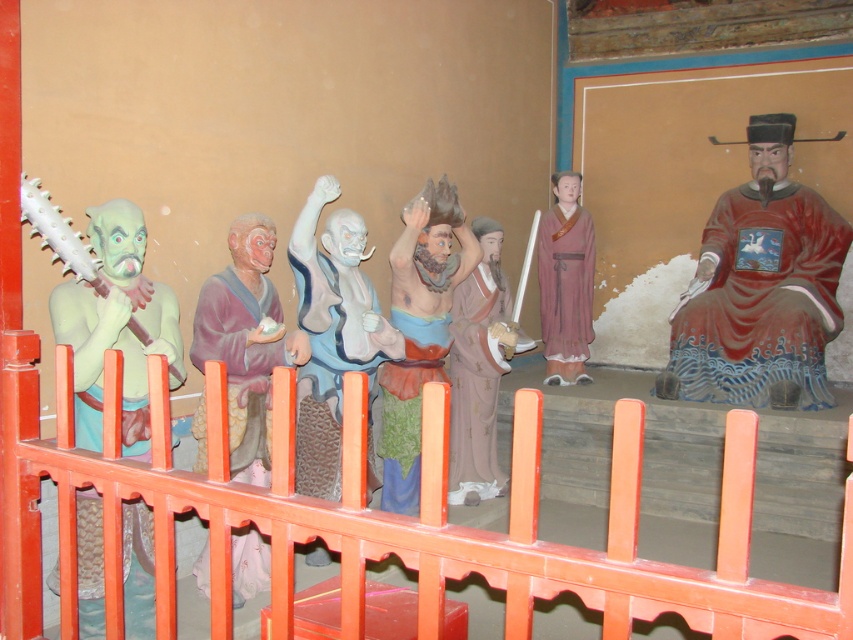
Question: Is red glossy robe at right below pink silk robe at center?

Choices:
 (A) yes
 (B) no

Answer: (B)

Question: Which is nearer to the green painted wood figure at left?

Choices:
 (A) pink silk robe at center
 (B) orange painted wood rail at center
 (C) matte brown robe at center

Answer: (B)

Question: Does matte clay figure at center come in front of white matte robe at center?

Choices:
 (A) no
 (B) yes

Answer: (A)

Question: Which object is positioned farthest from the green painted wood figure at left?

Choices:
 (A) matte clay figure at center
 (B) matte brown robe at center
 (C) matte pink robe at center

Answer: (B)

Question: Which point is farther to the camera?

Choices:
 (A) white matte robe at center
 (B) red glossy robe at right

Answer: (B)

Question: Can you confirm if matte pink robe at center is wider than pink silk robe at center?

Choices:
 (A) no
 (B) yes

Answer: (B)